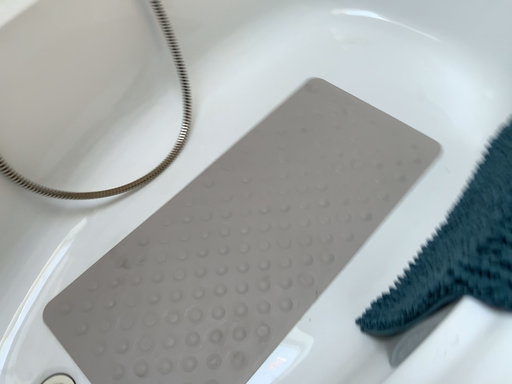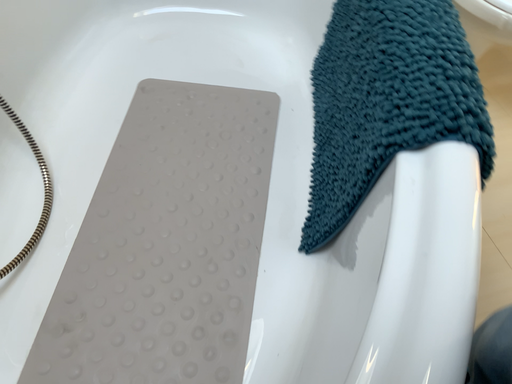
Question: How did the camera likely rotate when shooting the video?

Choices:
 (A) rotated left
 (B) rotated right

Answer: (B)